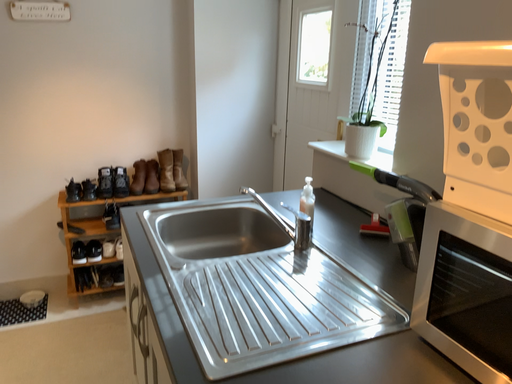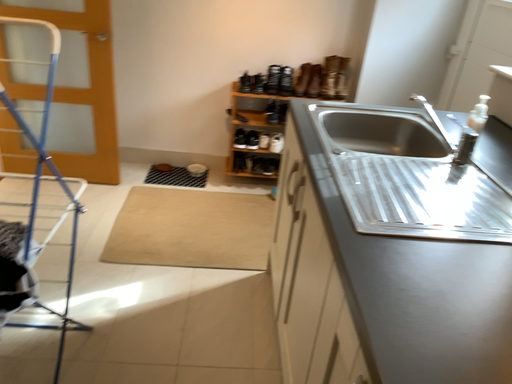
Question: Which way did the camera rotate in the video?

Choices:
 (A) rotated left
 (B) rotated right

Answer: (A)